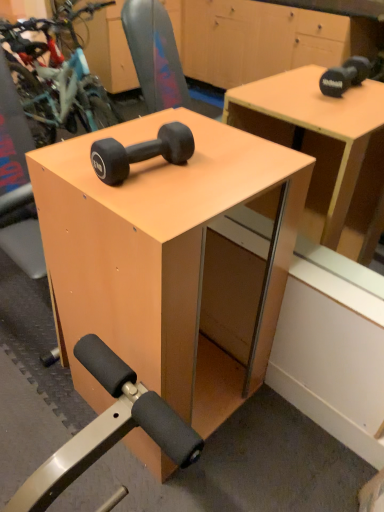
This screenshot has width=384, height=512. In order to click on vacant area in front of matte black dumbbell at center in this screenshot , I will do `click(150, 202)`.